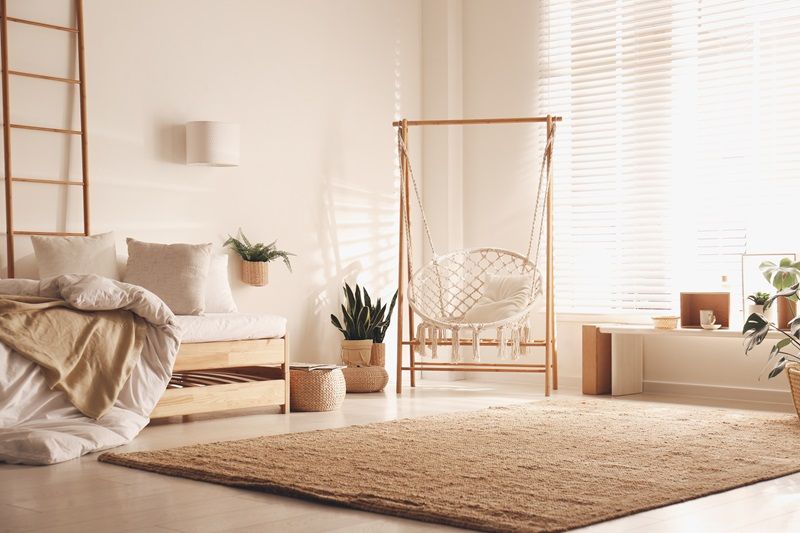
The width and height of the screenshot is (800, 533). Find the location of `blinds`. blinds is located at coordinates (598, 115), (646, 101), (716, 88), (778, 80), (561, 85).